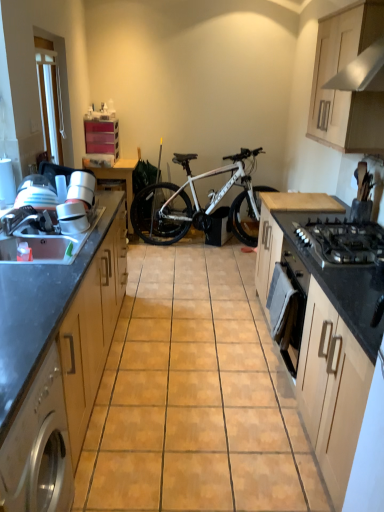
Question: From a real-world perspective, relative to white glossy blender at left, is white glossy exhaust hood at upper right vertically above or below?

Choices:
 (A) above
 (B) below

Answer: (A)

Question: Is white glossy exhaust hood at upper right situated inside white glossy blender at left or outside?

Choices:
 (A) outside
 (B) inside

Answer: (A)

Question: Based on their relative distances, which object is farther from the white glossy blender at left?

Choices:
 (A) black matte gas stove at center right
 (B) wooden cabinet at left, the 1th cabinetry from the left
 (C) beige matte cabinet at right, which appears as the 2th cabinetry when viewed from the right
 (D) wooden table at center
 (E) wooden cabinet at upper right, the first cabinetry from the right

Answer: (D)

Question: Considering the real-world distances, which object is farthest from the wooden table at center?

Choices:
 (A) stainless steel washing machine at left
 (B) wooden cabinet at upper right, the third cabinetry viewed from the left
 (C) white glossy exhaust hood at upper right
 (D) white matte bicycle at center
 (E) black matte gas stove at center right

Answer: (A)